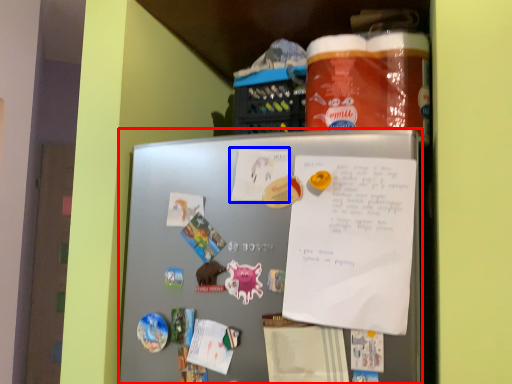
Question: Among these objects, which one is farthest to the camera, refrigerator (highlighted by a red box) or paper (highlighted by a blue box)?

Choices:
 (A) refrigerator
 (B) paper

Answer: (B)